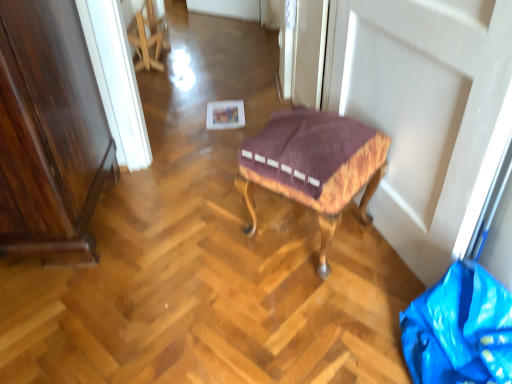
Question: Can we say blue plastic bag at lower right lies outside velvet upholstered stool at center?

Choices:
 (A) yes
 (B) no

Answer: (A)

Question: Considering the relative sizes of blue plastic bag at lower right and velvet upholstered stool at center in the image provided, is blue plastic bag at lower right thinner than velvet upholstered stool at center?

Choices:
 (A) no
 (B) yes

Answer: (A)

Question: Could velvet upholstered stool at center be considered to be inside blue plastic bag at lower right?

Choices:
 (A) yes
 (B) no

Answer: (B)

Question: Is blue plastic bag at lower right turned away from velvet upholstered stool at center?

Choices:
 (A) no
 (B) yes

Answer: (A)

Question: From the image's perspective, is blue plastic bag at lower right over velvet upholstered stool at center?

Choices:
 (A) no
 (B) yes

Answer: (A)

Question: From a real-world perspective, is blue plastic bag at lower right under velvet upholstered stool at center?

Choices:
 (A) no
 (B) yes

Answer: (B)

Question: Is velvet upholstered stool at center positioned in front of blue plastic bag at lower right?

Choices:
 (A) no
 (B) yes

Answer: (A)

Question: Can you confirm if velvet upholstered stool at center is thinner than blue plastic bag at lower right?

Choices:
 (A) no
 (B) yes

Answer: (B)

Question: Is velvet upholstered stool at center bigger than blue plastic bag at lower right?

Choices:
 (A) no
 (B) yes

Answer: (B)

Question: Is velvet upholstered stool at center smaller than blue plastic bag at lower right?

Choices:
 (A) yes
 (B) no

Answer: (B)

Question: From a real-world perspective, does velvet upholstered stool at center stand above blue plastic bag at lower right?

Choices:
 (A) yes
 (B) no

Answer: (A)

Question: Considering the relative sizes of velvet upholstered stool at center and blue plastic bag at lower right in the image provided, is velvet upholstered stool at center taller than blue plastic bag at lower right?

Choices:
 (A) yes
 (B) no

Answer: (A)

Question: Is velvet upholstered stool at center taller or shorter than blue plastic bag at lower right?

Choices:
 (A) tall
 (B) short

Answer: (A)